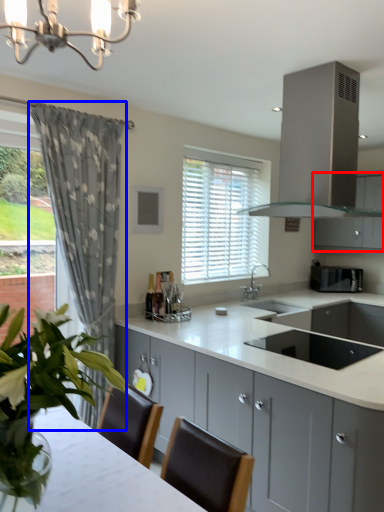
Question: Which of the following is the closest to the observer, cabinetry (highlighted by a red box) or curtain (highlighted by a blue box)?

Choices:
 (A) cabinetry
 (B) curtain

Answer: (B)